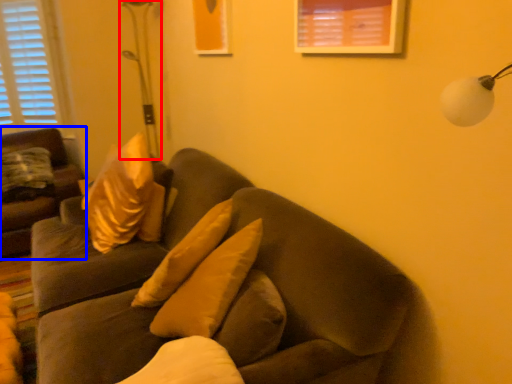
Question: Which object appears closest to the camera in this image, table lamp (highlighted by a red box) or studio couch (highlighted by a blue box)?

Choices:
 (A) table lamp
 (B) studio couch

Answer: (B)